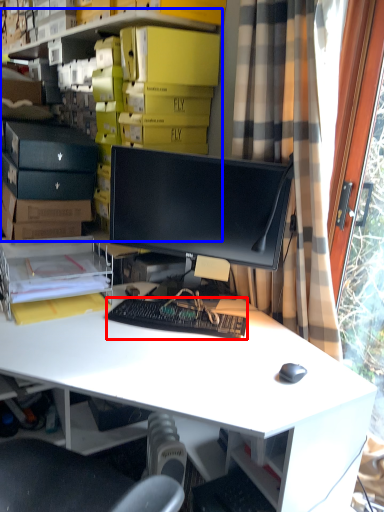
Question: Which object is closer to the camera taking this photo, computer keyboard (highlighted by a red box) or bookshelf (highlighted by a blue box)?

Choices:
 (A) computer keyboard
 (B) bookshelf

Answer: (A)